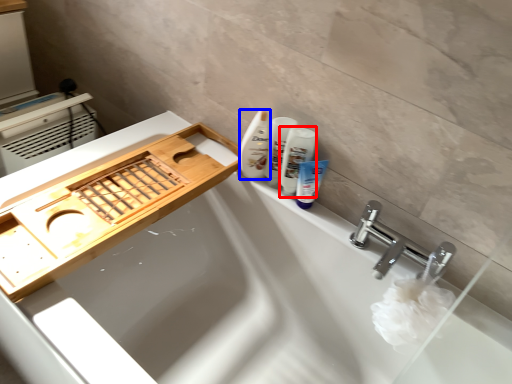
Question: Which object is further to the camera taking this photo, mouthwash (highlighted by a red box) or cleaning product (highlighted by a blue box)?

Choices:
 (A) mouthwash
 (B) cleaning product

Answer: (B)